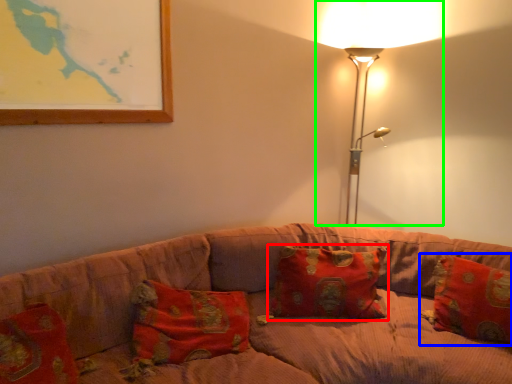
Question: Estimate the real-world distances between objects in this image. Which object is closer to pillow (highlighted by a red box), pillow (highlighted by a blue box) or lamp (highlighted by a green box)?

Choices:
 (A) pillow
 (B) lamp

Answer: (A)